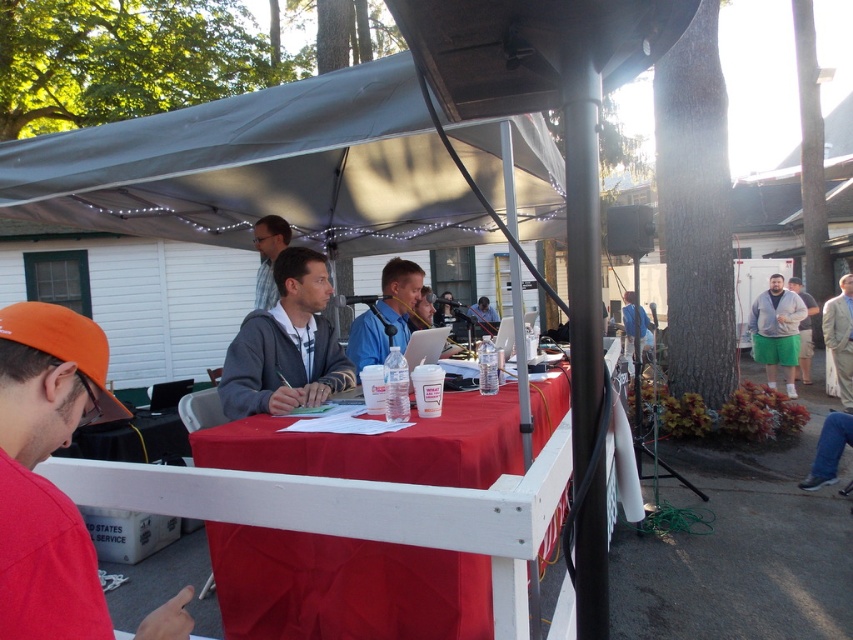
Question: Estimate the real-world distances between objects in this image. Which object is farther from the orange fabric cap at left?

Choices:
 (A) gray fleece vest at right
 (B) gray hoodie at center
 (C) gray fabric canopy at upper center

Answer: (A)

Question: Can you confirm if red cloth at center is wider than orange fabric cap at left?

Choices:
 (A) yes
 (B) no

Answer: (A)

Question: Among these points, which one is nearest to the camera?

Choices:
 (A) (299, 272)
 (B) (480, 620)

Answer: (B)

Question: Can you confirm if orange fabric cap at left is positioned below gray hoodie at center?

Choices:
 (A) no
 (B) yes

Answer: (B)

Question: Does green cotton shorts at right appear under blue backpack at center-right?

Choices:
 (A) yes
 (B) no

Answer: (A)

Question: Which of the following is the closest to the observer?

Choices:
 (A) (263, 532)
 (B) (807, 346)

Answer: (A)